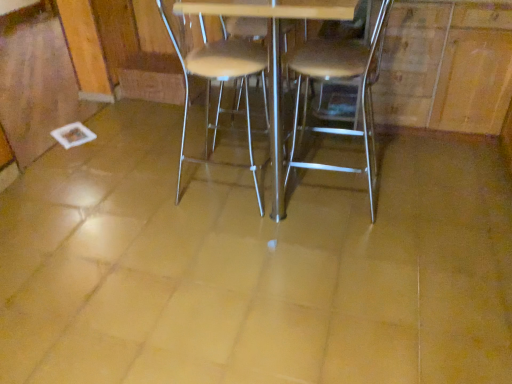
Identify the location of vacant space underneath metallic silver chair at center, arranged as the second chair when viewed from the right (from a real-world perspective). This screenshot has height=384, width=512. (215, 182).